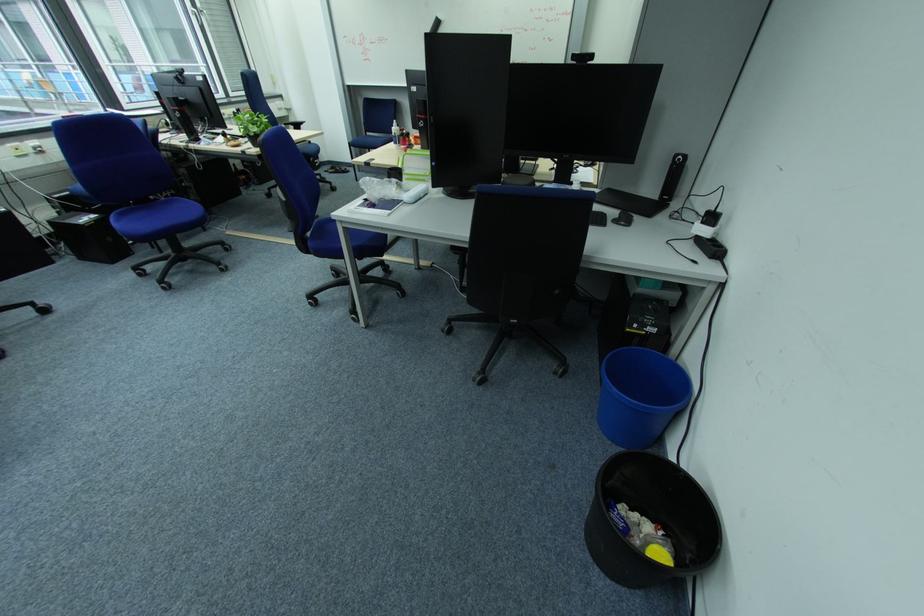
In order to click on speaker volume knob in this screenshot , I will do `click(672, 177)`.